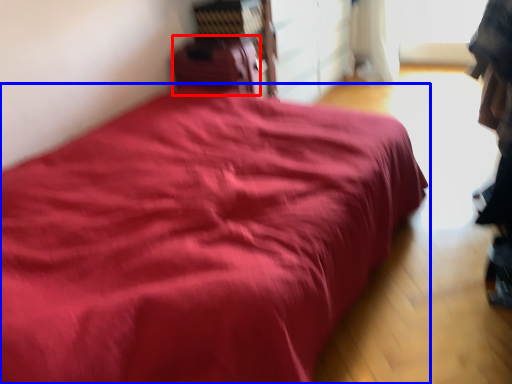
Question: Which object is further to the camera taking this photo, luggage (highlighted by a red box) or bed (highlighted by a blue box)?

Choices:
 (A) luggage
 (B) bed

Answer: (A)